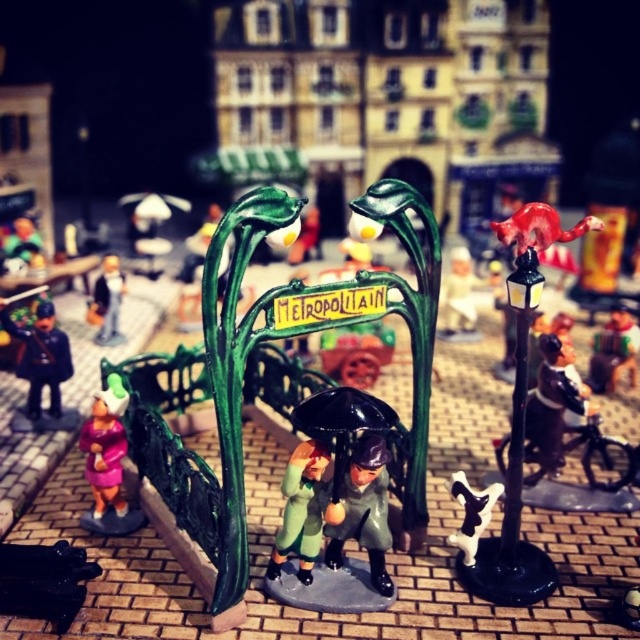
Question: Is shiny black umbrella at center positioned in front of matte green umbrella at center?

Choices:
 (A) yes
 (B) no

Answer: (A)

Question: Which point is farther to the camera?

Choices:
 (A) (330, 529)
 (B) (483, 508)
 (C) (320, 467)

Answer: (B)

Question: Which point is closer to the camera?

Choices:
 (A) (323, 451)
 (B) (620, 308)
 (C) (328, 458)

Answer: (A)

Question: Does matte green coat at center appear on the left side of white glossy cow at center?

Choices:
 (A) yes
 (B) no

Answer: (A)

Question: Which point is farther to the camera?

Choices:
 (A) (122, 529)
 (B) (449, 278)
 (C) (122, 289)

Answer: (B)

Question: Is matte green umbrella at center to the left of shiny black uniform at left from the viewer's perspective?

Choices:
 (A) yes
 (B) no

Answer: (B)